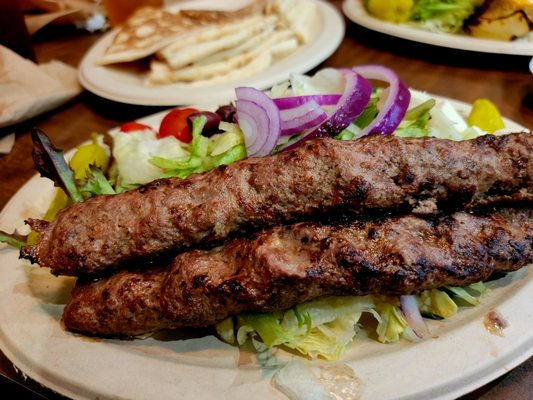
Find the location of a particular element. Image resolution: width=533 pixels, height=400 pixels. paper plate is located at coordinates (417, 376).